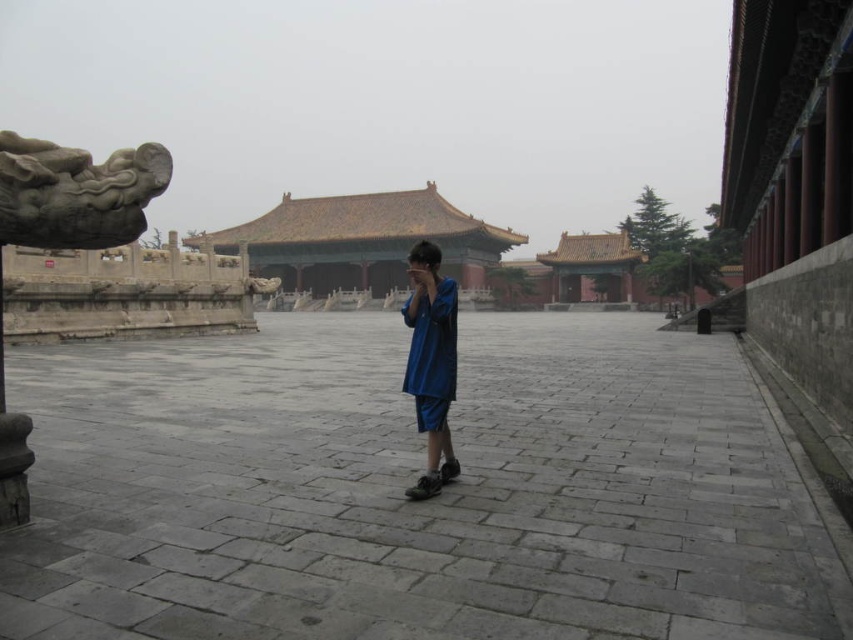
Question: Is yellow/golden tile roof at center positioned at the back of blue cotton robe at center?

Choices:
 (A) no
 (B) yes

Answer: (B)

Question: Does yellow/golden tile roof at center have a greater width compared to blue cotton robe at center?

Choices:
 (A) no
 (B) yes

Answer: (B)

Question: Is yellow/golden tile roof at center to the right of blue cotton robe at center from the viewer's perspective?

Choices:
 (A) yes
 (B) no

Answer: (B)

Question: Which point is closer to the camera?

Choices:
 (A) blue cotton robe at center
 (B) yellow/golden tile roof at center

Answer: (A)

Question: Among these objects, which one is farthest from the camera?

Choices:
 (A) yellow/golden tile roof at center
 (B) blue cotton robe at center

Answer: (A)

Question: Among these points, which one is farthest from the camera?

Choices:
 (A) (410, 300)
 (B) (469, 221)

Answer: (B)